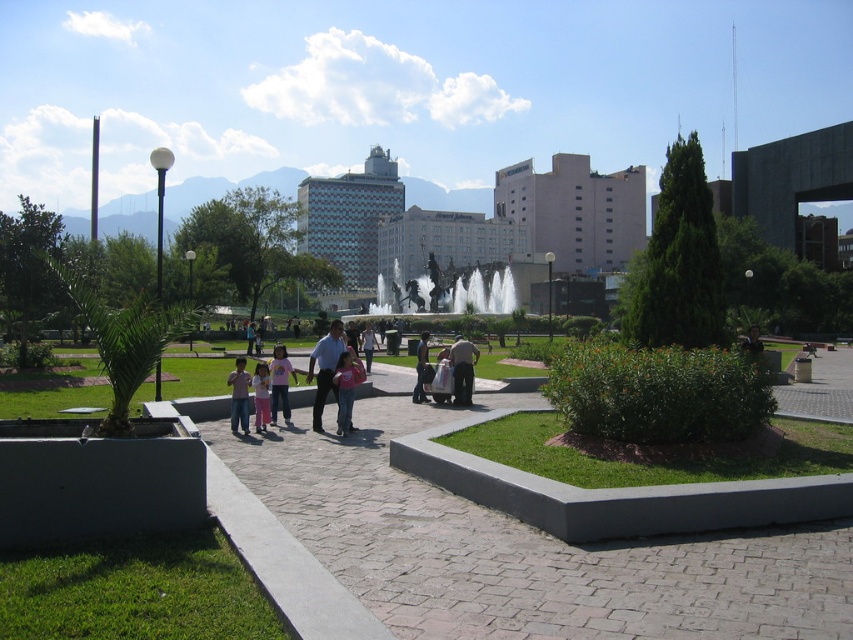
Who is positioned more to the left, light blue shirt at center or dark blue jeans at center?

From the viewer's perspective, light blue shirt at center appears more on the left side.

Which is in front, point (328, 333) or point (421, 381)?

Point (421, 381) is in front.

The height and width of the screenshot is (640, 853). I want to click on light blue shirt at center, so click(x=325, y=369).

Find the location of a particular element. pink cotton shirt at center is located at coordinates (280, 381).

Between point (293, 376) and point (241, 401), which one is positioned in front?

Point (241, 401)

Identify the location of pink cotton shirt at center. [280, 381].

Who is taller, light blue shirt at center or pink fabric dress at center?

Standing taller between the two is light blue shirt at center.

Who is shorter, light blue shirt at center or pink fabric dress at center?

With less height is pink fabric dress at center.

Where is `light blue shirt at center`? light blue shirt at center is located at coordinates (325, 369).